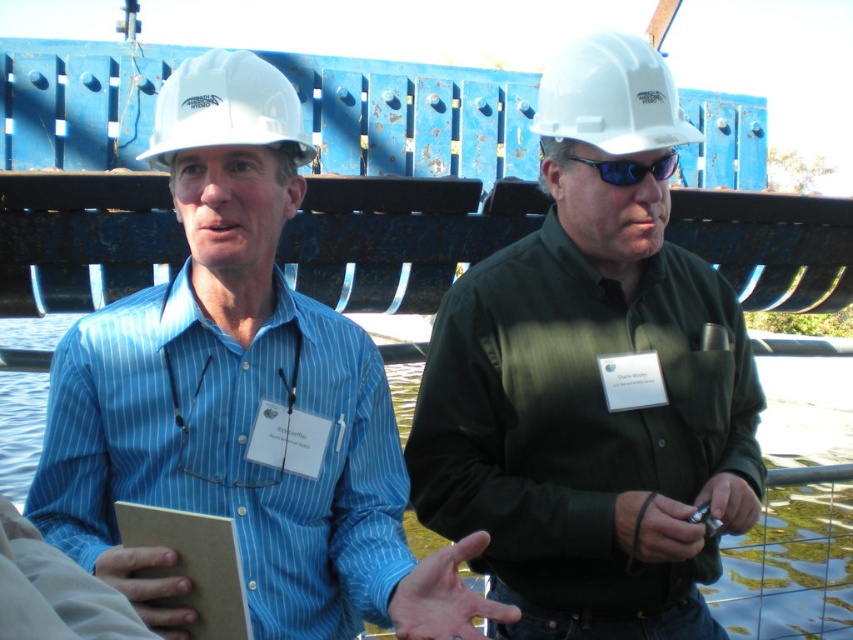
You are a safety inspector at the construction site. You need to check if the workers are wearing their hard hats correctly. According to the image, is the matte black shirt at center positioned under the white hard hat at upper center?

Yes, the matte black shirt at center is below the white hard hat at upper center, which means the worker is wearing the hard hat correctly.

You are standing at the construction site and want to move from point A to point B. Point A is at coordinate point(682, 278) and point B is at coordinate point(619, 88). Which point is closer to you?

Point A at coordinate point(682, 278) is closer to you because it is further to the viewer than point B at coordinate point(619, 88).